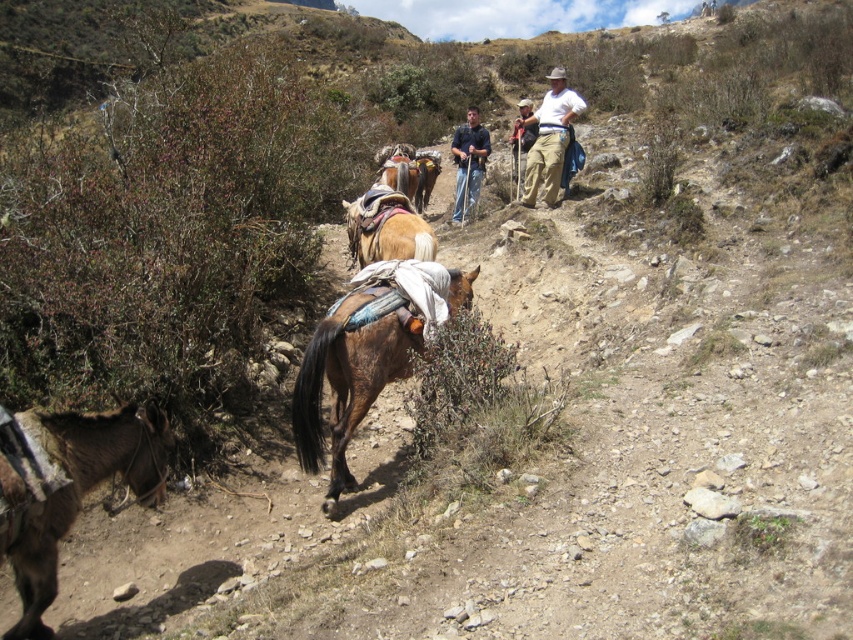
You are standing at the point marked by the coordinates point (468,163). Looking around, you see a horse with a dark brown coat and a black mane and tail in the foreground. Where is the horse relative to your current position?

The horse is in the foreground, so it is closer to you than the blue jeans at center represented by point (468,163).

You are a hiker trying to navigate the mountain path shown in the image. There is a brown rough horse at center located at point [345,385]. If you want to avoid the horse, which direction should you move relative to the horse?

The brown rough horse at center is located at point [345,385]. To avoid it, you should move away from that coordinate, either north, south, east, or west depending on your current position relative to the horse.

From the picture: You are a photographer trying to capture a photo of the blue jeans at center and the brown textured mule at center. Since you want to focus on both subjects equally, which one should you zoom in on more to ensure they appear the same size in the photo?

The blue jeans at center has a lesser width compared to the brown textured mule at center, so you should zoom in more on the blue jeans at center to make them appear the same size as the brown textured mule at center in the photo.